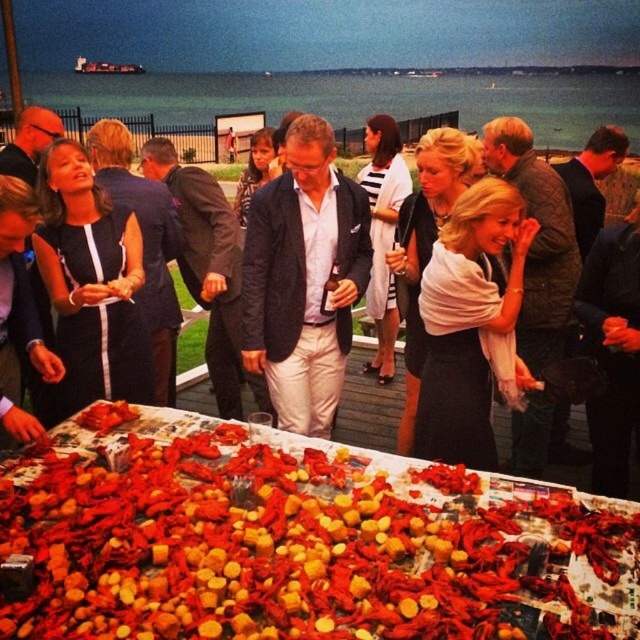
Can you confirm if matte black dress at left is smaller than matte black dress at center?

Actually, matte black dress at left might be larger than matte black dress at center.

Based on the photo, measure the distance between point (124, 337) and camera.

3.73 meters

Image resolution: width=640 pixels, height=640 pixels. In order to click on matte black dress at left in this screenshot , I will do `click(92, 284)`.

Is matte black blazer at center in front of matte black dress at left?

No, matte black blazer at center is further to the viewer.

Does point (260, 362) come behind point (138, 312)?

Yes.

What are the coordinates of `matte black blazer at center` in the screenshot? It's located at (304, 278).

Is matte black blazer at center smaller than matte black dress at center?

No.

Measure the distance between point (314, 145) and camera.

The distance of point (314, 145) from camera is 3.49 meters.

Who is more distant from viewer, (276, 186) or (188, 390)?

The point (188, 390) is behind.

Find the location of a particular element. This screenshot has width=640, height=640. matte black blazer at center is located at coordinates (304, 278).